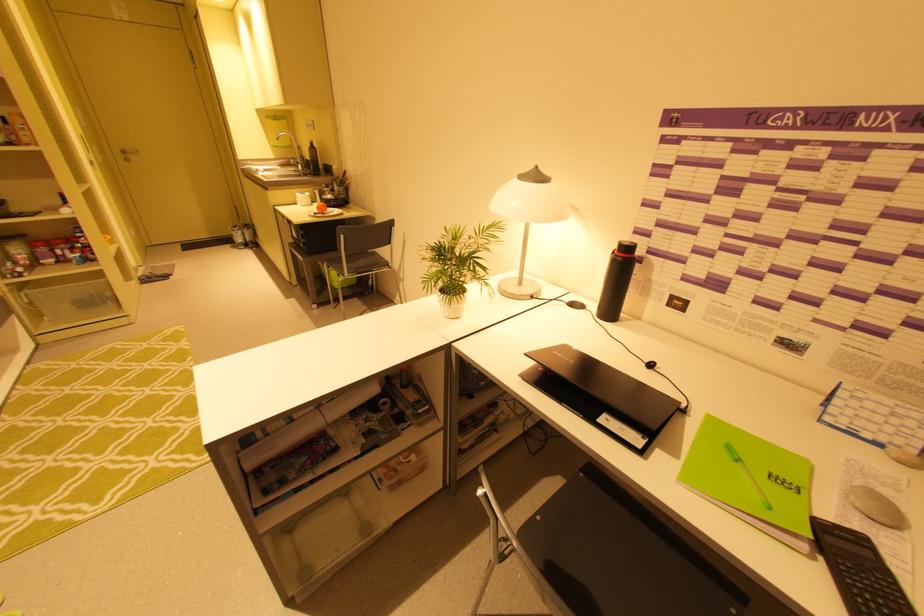
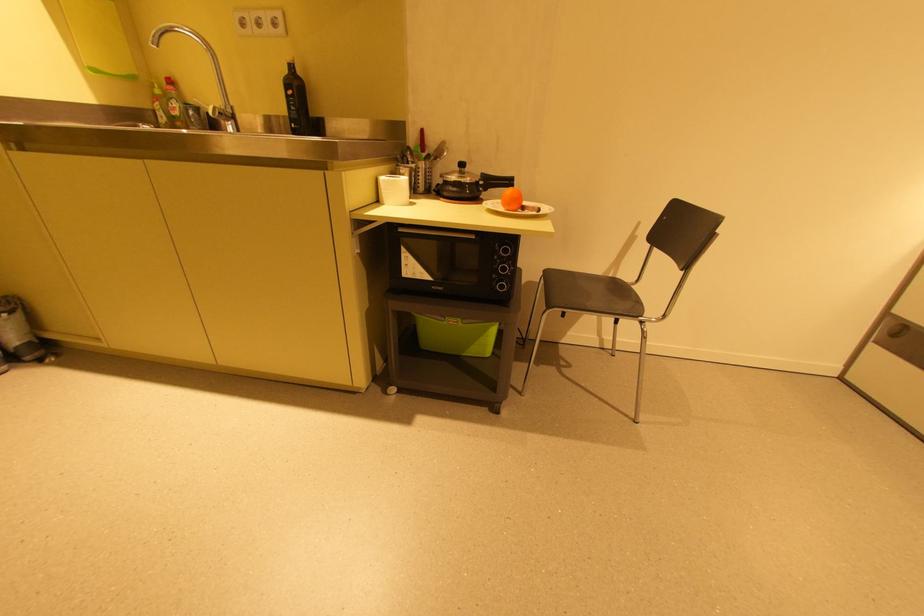
Find the pixel in the second image that matches point 313,146 in the first image.

(289, 71)